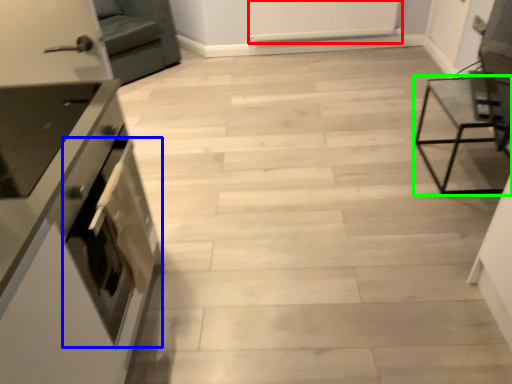
Question: Which object is positioned farthest from radiator (highlighted by a red box)? Select from oven (highlighted by a blue box) and furniture (highlighted by a green box).

Choices:
 (A) oven
 (B) furniture

Answer: (A)